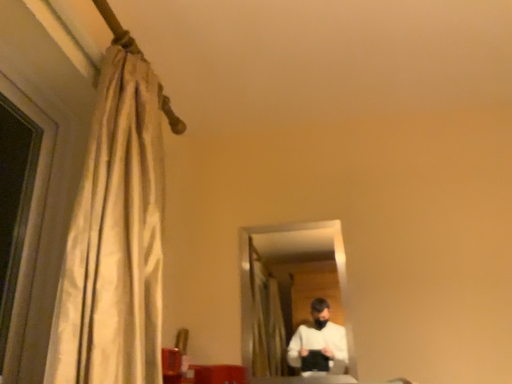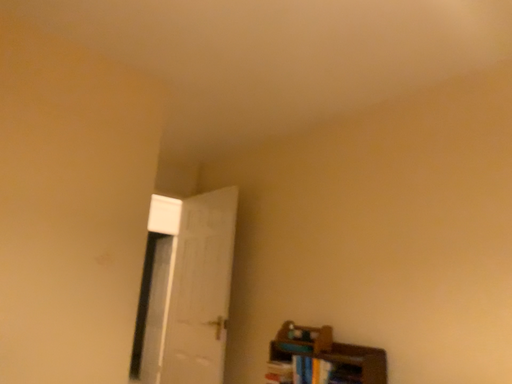
Question: How did the camera likely rotate when shooting the video?

Choices:
 (A) rotated downward
 (B) rotated upward

Answer: (A)